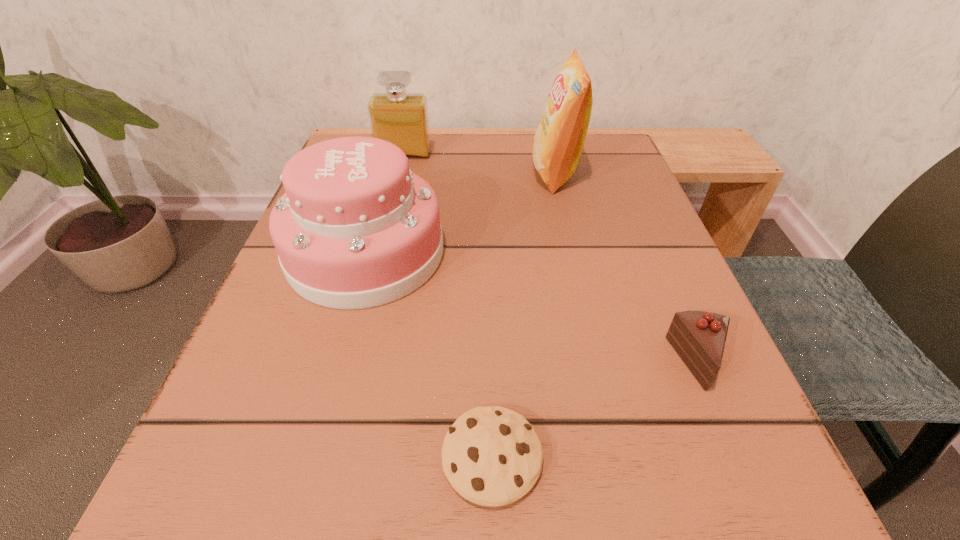
The height and width of the screenshot is (540, 960). Find the location of `blank space located 0.140m on the front-facing side of the tallest object`. blank space located 0.140m on the front-facing side of the tallest object is located at coordinates (464, 173).

This screenshot has width=960, height=540. What are the coordinates of `vacant space situated on the front-facing side of the perfume` in the screenshot? It's located at (386, 229).

You are a GUI agent. You are given a task and a screenshot of the screen. Output one action in this format:
    pyautogui.click(x=<x>, y=<y>)
    Task: Click on the vacant space situated 0.150m on the back of the third farthest object
    
    Given the screenshot: What is the action you would take?
    391,166

Locate an element on the screen. The width and height of the screenshot is (960, 540). free location located 0.390m on the back of the rightmost object is located at coordinates (622, 181).

Locate an element on the screen. This screenshot has height=540, width=960. vacant space situated on the left of the nearest object is located at coordinates (268, 457).

This screenshot has width=960, height=540. Identify the location of crisp (potato chip) located in the far edge section of the desktop. pyautogui.click(x=558, y=143).

Image resolution: width=960 pixels, height=540 pixels. I want to click on perfume positioned at the far edge, so click(x=401, y=118).

The width and height of the screenshot is (960, 540). In order to click on object that is at the near edge in this screenshot , I will do `click(492, 456)`.

I want to click on perfume situated at the left edge, so click(x=401, y=118).

Where is `cake at the left edge`? The image size is (960, 540). cake at the left edge is located at coordinates (355, 229).